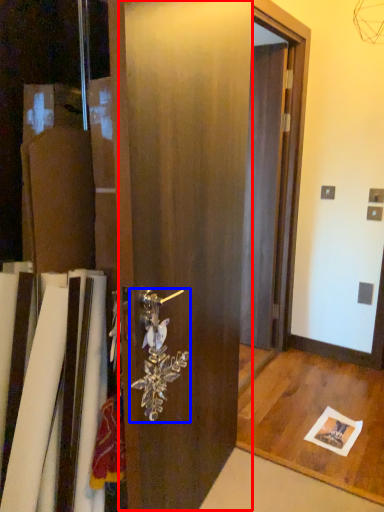
Question: Among these objects, which one is nearest to the camera, barn door (highlighted by a red box) or door handle (highlighted by a blue box)?

Choices:
 (A) barn door
 (B) door handle

Answer: (A)